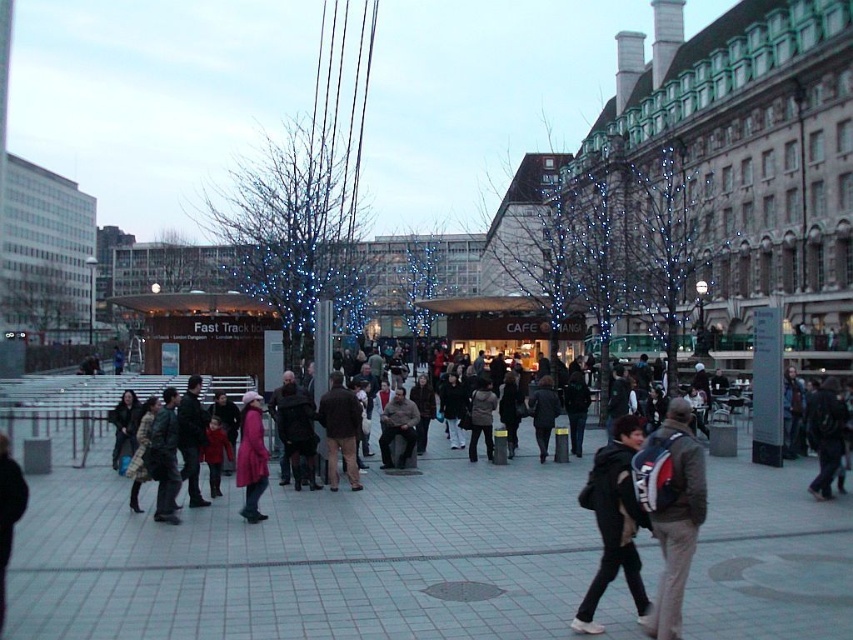
From the picture: You are standing at the entrance of the plaza and want to meet a friend who is carrying a matte black backpack at center. According to the coordinates provided, where should you look to find them?

Your friend with the matte black backpack at center is located at coordinates point (x=671, y=508).

You are standing in the plaza and want to take a photo of both point (640, 483) and point (633, 593). Which point should you focus on first to ensure both are in clear view?

You should focus on point (640, 483) first because it is closer to the camera than point (633, 593), ensuring both points are in focus.